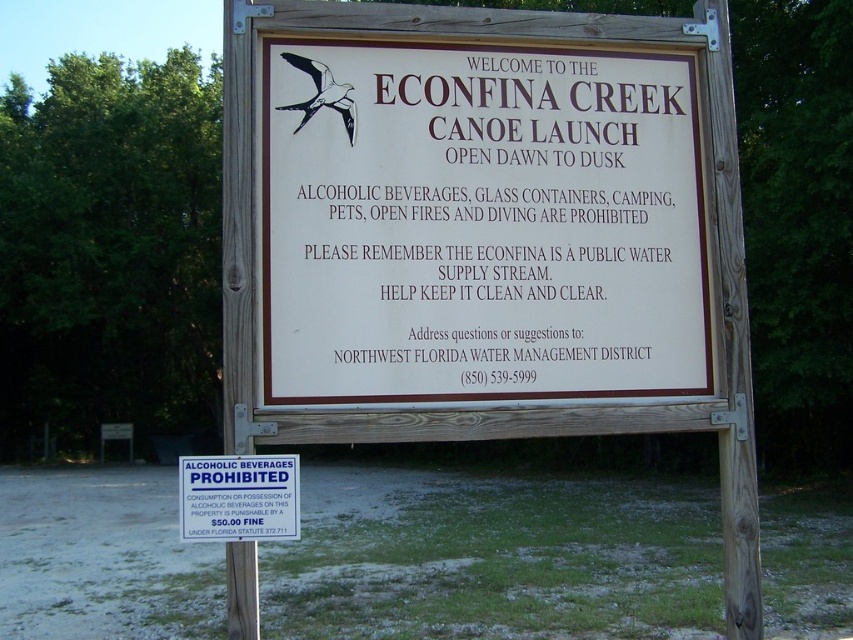
You are planning to launch your canoe at the Econfin Creek Canoe Launch and see both the white wood sign at center and the blue plastic sign at center. Which sign should you read first based on their positions?

The white wood sign at center is located above the blue plastic sign at center, so you should read the white wood sign at center first since it is positioned higher up.

You are a park ranger who needs to place a new 1.5 meter wide bench between the white wood sign at center and the blue plastic sign at center. Is there enough space between them to fit the bench?

The distance between the white wood sign at center and the blue plastic sign at center is 1.38 meters, which is less than the bench width of 1.5 meters. Therefore, the bench cannot be placed between them.